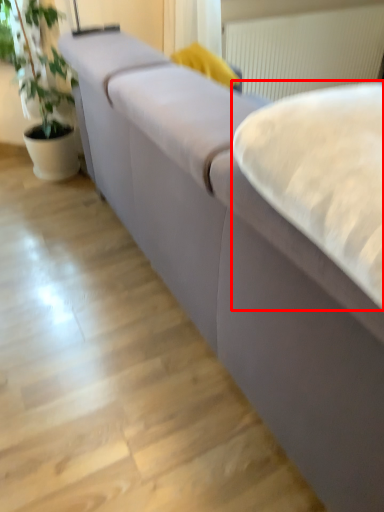
Question: From the image, what is the correct spatial relationship of sheet (annotated by the red box) in relation to radiator?

Choices:
 (A) left
 (B) right

Answer: (A)